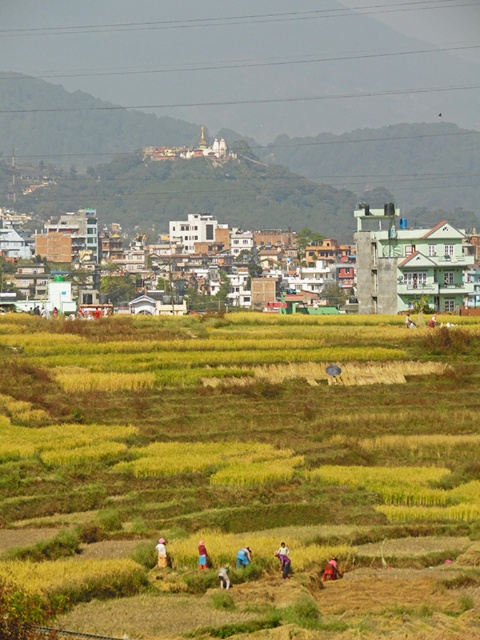
Question: Is blue jeans at lower center to the right of light pink fabric at lower center from the viewer's perspective?

Choices:
 (A) yes
 (B) no

Answer: (A)

Question: Which point appears farthest from the camera in this image?

Choices:
 (A) (197, 547)
 (B) (236, 560)
 (C) (228, 579)

Answer: (A)

Question: Does yellow-green grassland at center have a larger size compared to blue jeans at lower center?

Choices:
 (A) no
 (B) yes

Answer: (B)

Question: Can you confirm if brown fabric at center is positioned to the right of blue denim jeans at lower center?

Choices:
 (A) no
 (B) yes

Answer: (A)

Question: Based on their relative distances, which object is nearer to the brown fabric at center?

Choices:
 (A) yellow-green grassland at center
 (B) brown fabric person at lower center
 (C) blue jeans at lower center

Answer: (C)

Question: Among these points, which one is nearest to the camera?

Choices:
 (A) (223, 572)
 (B) (164, 564)
 (C) (336, 572)
 (D) (442, 540)

Answer: (A)